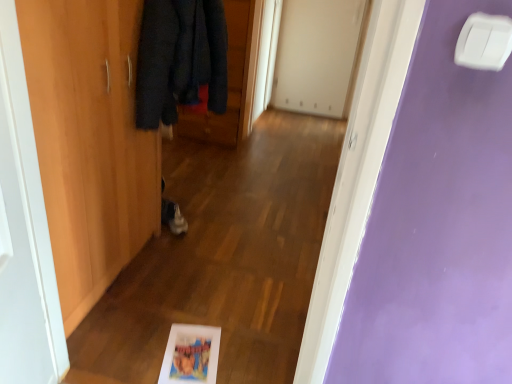
Locate an element on the screen. free location to the left of matte plastic picture frame at lower center is located at coordinates (128, 357).